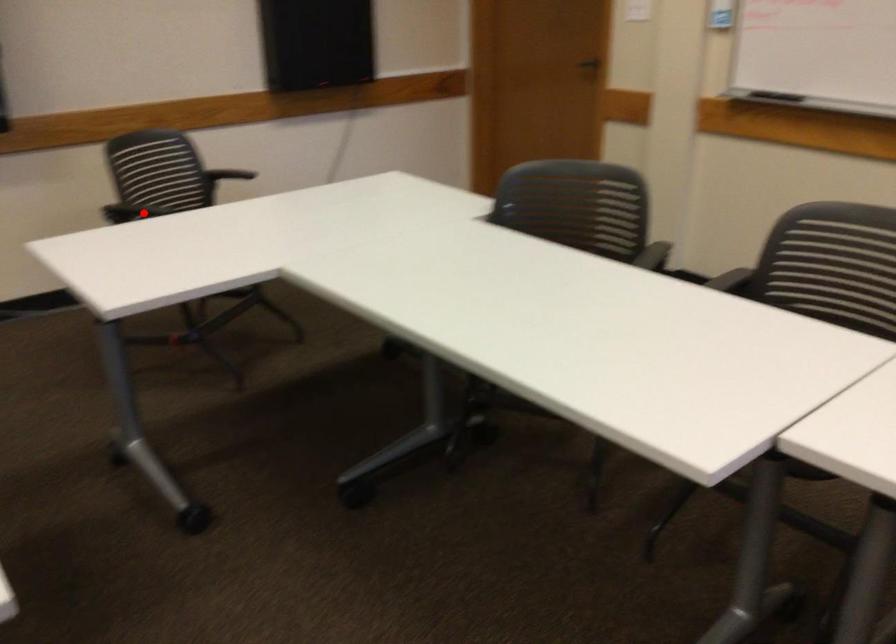
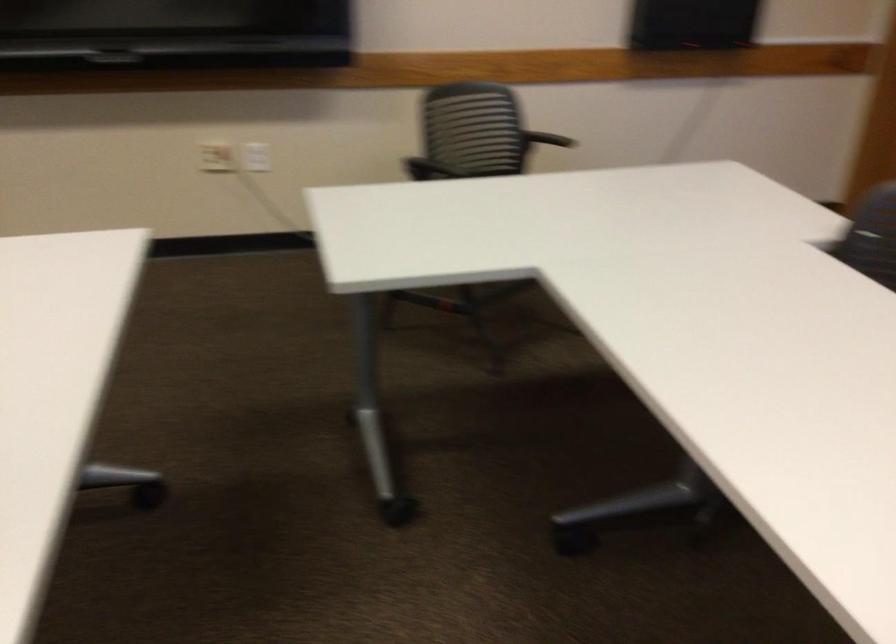
Find the pixel in the second image that matches the highlighted location in the first image.

(425, 169)